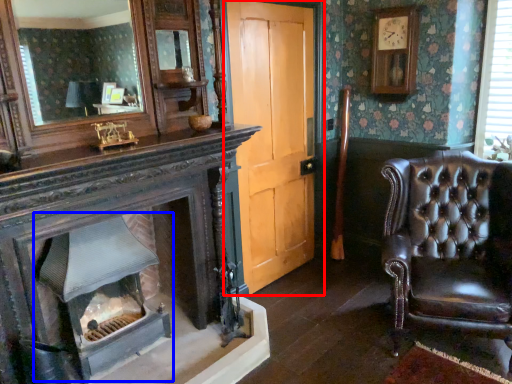
Question: Among these objects, which one is nearest to the camera, door (highlighted by a red box) or fireplace (highlighted by a blue box)?

Choices:
 (A) door
 (B) fireplace

Answer: (B)